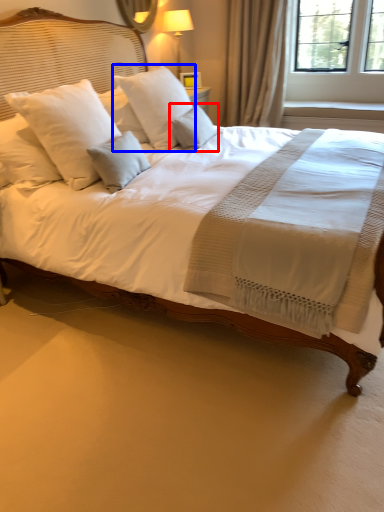
Question: Which object is further to the camera taking this photo, pillow (highlighted by a red box) or pillow (highlighted by a blue box)?

Choices:
 (A) pillow
 (B) pillow

Answer: (A)